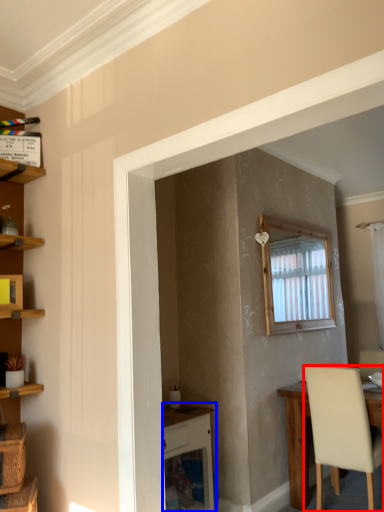
Question: Which of the following is the closest to the observer, chair (highlighted by a red box) or vanity (highlighted by a blue box)?

Choices:
 (A) chair
 (B) vanity

Answer: (B)